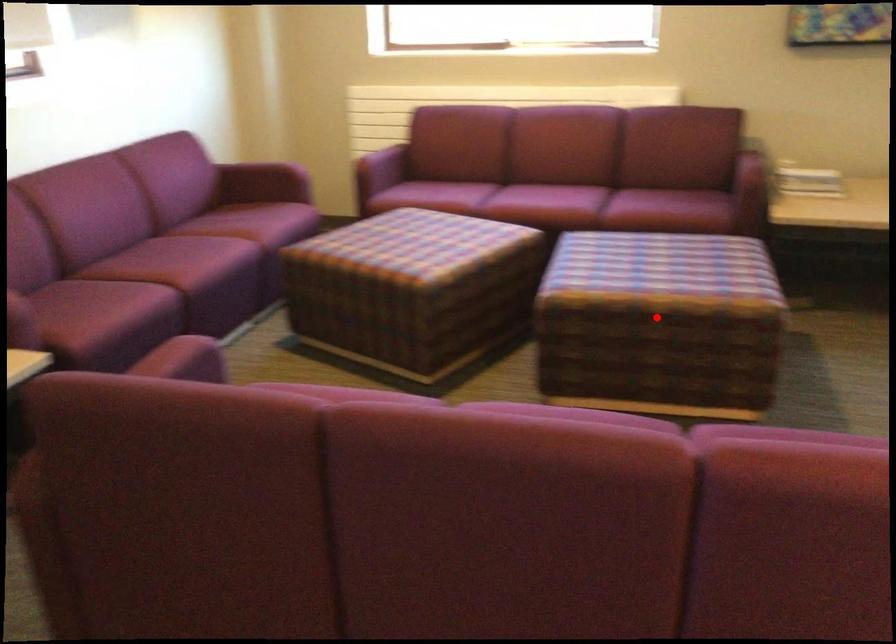
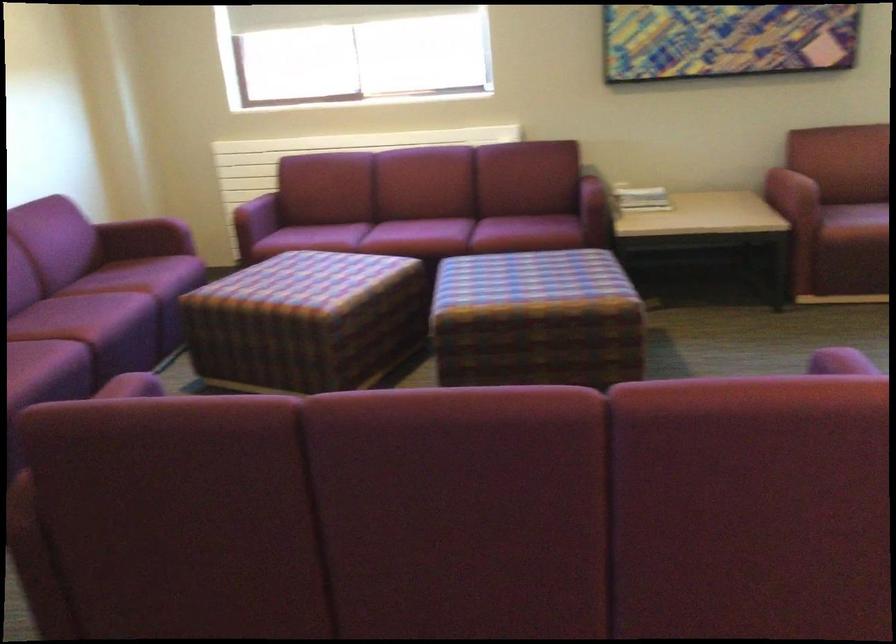
In the second image, find the point that corresponds to the highlighted location in the first image.

(536, 319)